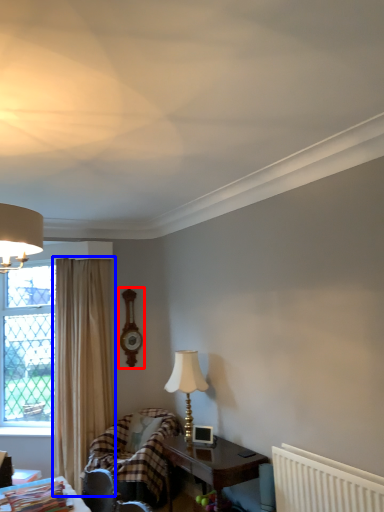
Question: Among these objects, which one is farthest to the camera, clock (highlighted by a red box) or curtain (highlighted by a blue box)?

Choices:
 (A) clock
 (B) curtain

Answer: (A)